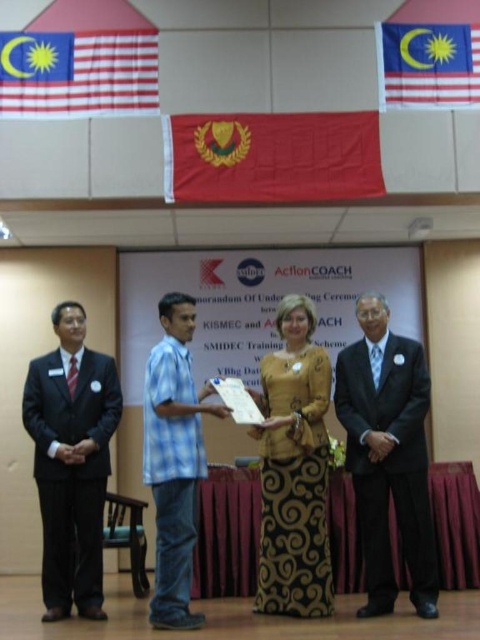
You are an event planner trying to set up a microphone stand for the speaker wearing the matte black suit at right. Based on the image provided, where should you place the microphone stand in terms of coordinates?

The microphone stand should be placed at the coordinates corresponding to the location of the matte black suit at right, which is at point [387,456].

You are a photographer at the event and need to capture a photo where both the matte black suit at right and the red fabric flag at upper left are visible. Considering their heights, which object should you focus on first to ensure both are in frame?

The matte black suit at right is taller than the red fabric flag at upper left, so you should focus on the matte black suit at right first to ensure both are in frame.

You are an event planner organizing a photo shoot for the ceremony. You need to ensure that the blue plaid shirt at center and the red fabric flag at upper right are both visible in the frame. Given their sizes, which object should you prioritize positioning closer to the camera to maintain their visibility?

The blue plaid shirt at center is larger in size compared to the red fabric flag at upper right. To ensure both are visible, prioritize positioning the red fabric flag at upper right closer to the camera since it is smaller and might need to be nearer to maintain visibility.